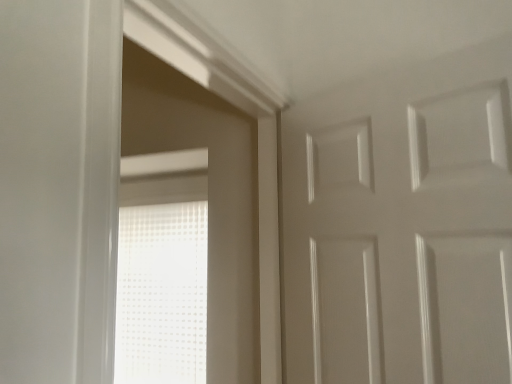
Describe the element at coordinates (402, 226) in the screenshot. I see `white glossy door at upper right` at that location.

In order to face white glossy door at upper right, should I rotate leftwards or rightwards?

Turn right approximately 15.871 degrees to face it.

Find the location of a particular element. Image resolution: width=512 pixels, height=384 pixels. white glossy door at upper right is located at coordinates (402, 226).

I want to click on white frosted glass window at center, so click(x=162, y=293).

This screenshot has height=384, width=512. Describe the element at coordinates (162, 293) in the screenshot. I see `white frosted glass window at center` at that location.

Locate an element on the screen. white glossy door at upper right is located at coordinates (402, 226).

Between white glossy door at upper right and white frosted glass window at center, which one appears on the left side from the viewer's perspective?

white frosted glass window at center.

Is white glossy door at upper right in front of or behind white frosted glass window at center in the image?

Visually, white glossy door at upper right is located in front of white frosted glass window at center.

Does point (337, 221) lie behind point (179, 337)?

No, (337, 221) is closer to viewer.

From the image's perspective, is white glossy door at upper right located above or below white frosted glass window at center?

Based on their image positions, white glossy door at upper right is located above white frosted glass window at center.

From a real-world perspective, is white glossy door at upper right positioned over white frosted glass window at center based on gravity?

Yes, from a real-world perspective, white glossy door at upper right is on top of white frosted glass window at center.

Which object is wider, white glossy door at upper right or white frosted glass window at center?

white glossy door at upper right is wider.

Who is shorter, white glossy door at upper right or white frosted glass window at center?

white glossy door at upper right.

Based on the photo, between white glossy door at upper right and white frosted glass window at center, which one has smaller size?

Smaller between the two is white frosted glass window at center.

Can white frosted glass window at center be found inside white glossy door at upper right?

Definitely not — white frosted glass window at center is not inside white glossy door at upper right.

Are white glossy door at upper right and white frosted glass window at center beside each other?

No, white glossy door at upper right is not in contact with white frosted glass window at center.

Is white glossy door at upper right oriented towards white frosted glass window at center?

No, white glossy door at upper right does not turn towards white frosted glass window at center.

Find the location of a particular element. This screenshot has width=512, height=384. door that is on the right side of white frosted glass window at center is located at coordinates (402, 226).

Between white frosted glass window at center and white glossy door at upper right, which one appears on the right side from the viewer's perspective?

white glossy door at upper right is more to the right.

Which object is further away from the camera, white frosted glass window at center or white glossy door at upper right?

white frosted glass window at center is further away from the camera.

Is point (140, 207) closer to viewer compared to point (395, 151)?

No, it is not.

From the image's perspective, between white frosted glass window at center and white glossy door at upper right, who is located below?

white frosted glass window at center, from the image's perspective.

From a real-world perspective, is white frosted glass window at center physically below white glossy door at upper right?

Yes.

Is white frosted glass window at center wider than white glossy door at upper right?

No.

Considering the sizes of white frosted glass window at center and white glossy door at upper right in the image, is white frosted glass window at center taller or shorter than white glossy door at upper right?

Considering their sizes, white frosted glass window at center has more height than white glossy door at upper right.

Is white frosted glass window at center bigger or smaller than white glossy door at upper right?

white frosted glass window at center is smaller than white glossy door at upper right.

Would you say white frosted glass window at center contains white glossy door at upper right?

No, white glossy door at upper right is located outside of white frosted glass window at center.

Based on the photo, are white frosted glass window at center and white glossy door at upper right making contact?

white frosted glass window at center is not next to white glossy door at upper right, and they're not touching.

Is white frosted glass window at center positioned with its back to white glossy door at upper right?

No, white glossy door at upper right is not at the back of white frosted glass window at center.

Measure the distance from white frosted glass window at center to white glossy door at upper right.

white frosted glass window at center is 37.93 inches from white glossy door at upper right.

Find the location of a particular element. window beneath the white glossy door at upper right (from a real-world perspective) is located at coordinates (162, 293).

At what (x,y) coordinates should I click in order to perform the action: click on door that appears on the right of white frosted glass window at center. Please return your answer as a coordinate pair (x, y). Looking at the image, I should click on (402, 226).

You are a GUI agent. You are given a task and a screenshot of the screen. Output one action in this format:
    pyautogui.click(x=<x>, y=<y>)
    Task: Click on the door that appears above the white frosted glass window at center (from the image's perspective)
    The image size is (512, 384).
    Given the screenshot: What is the action you would take?
    (402, 226)